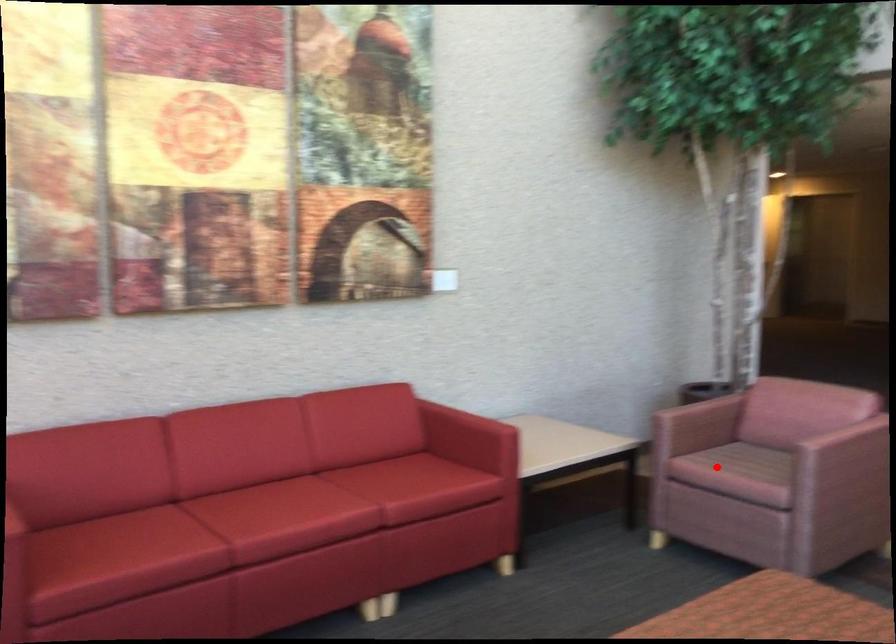
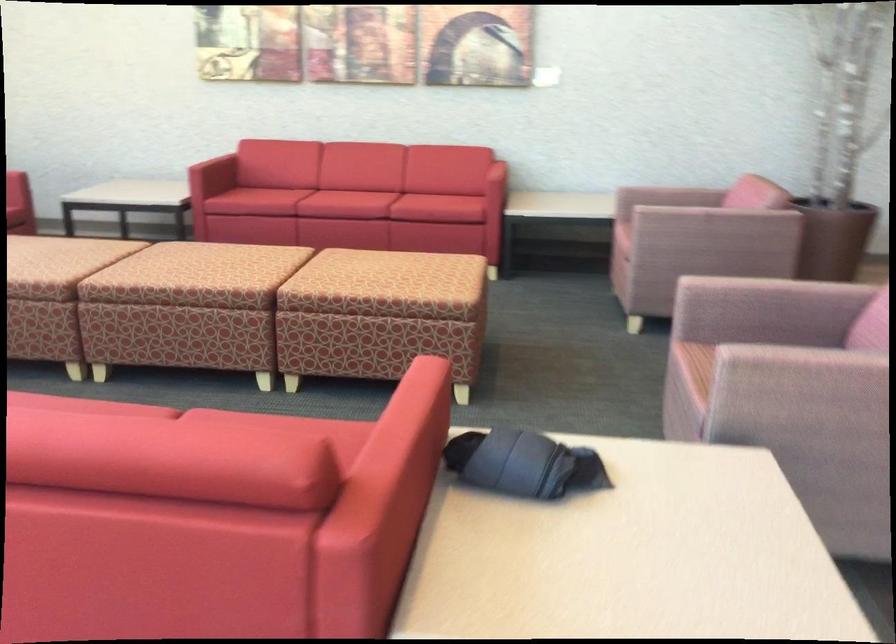
Question: I am providing you with two images of the same scene from different viewpoints. In image1, a red point is highlighted. Considering the same 3D point in image2, which of the following is correct?

Choices:
 (A) It is closer
 (B) It is farther

Answer: (B)